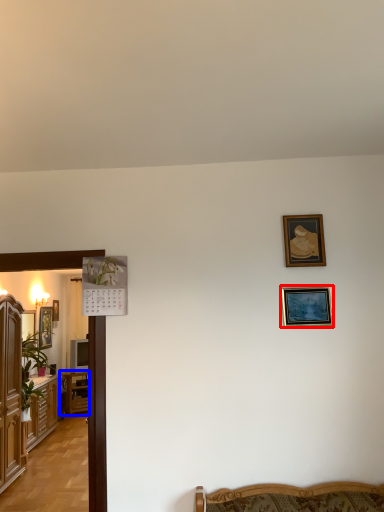
Question: Among these objects, which one is nearest to the camera, picture frame (highlighted by a red box) or table (highlighted by a blue box)?

Choices:
 (A) picture frame
 (B) table

Answer: (A)